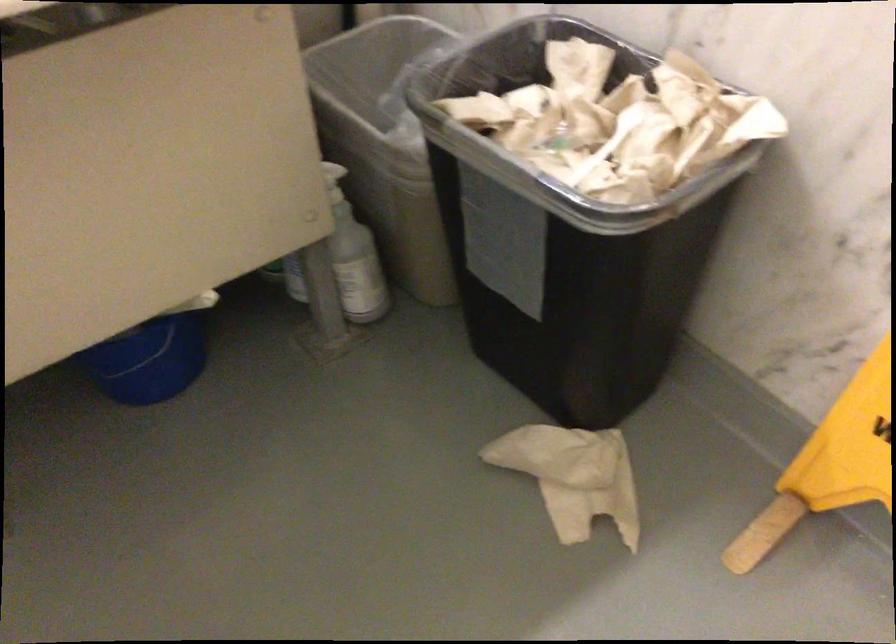
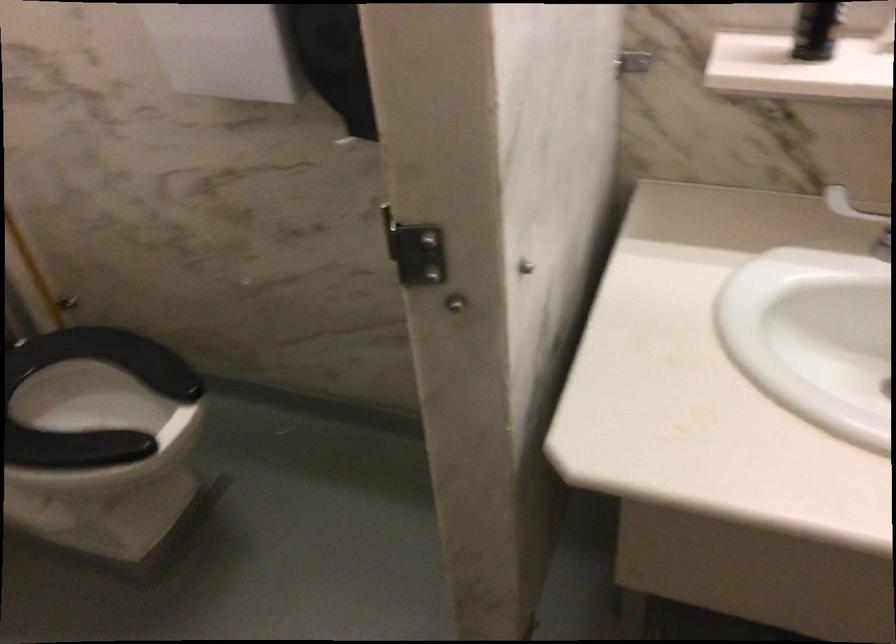
Question: The camera is either moving clockwise (left) or counter-clockwise (right) around the object. The first image is from the beginning of the video and the second image is from the end. Is the camera moving left or right when shooting the video?

Choices:
 (A) Left
 (B) Right

Answer: (B)